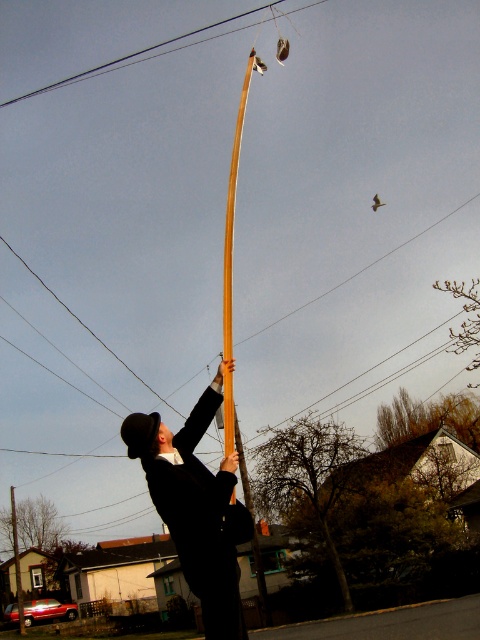
Question: Can you confirm if matte black coat at center is positioned below metallic wire at upper center?

Choices:
 (A) no
 (B) yes

Answer: (B)

Question: Does matte black coat at center have a larger size compared to wooden pole at upper center?

Choices:
 (A) no
 (B) yes

Answer: (A)

Question: Which point is farther to the camera?

Choices:
 (A) matte black coat at center
 (B) metallic wire at upper center

Answer: (B)

Question: From the image, what is the correct spatial relationship of matte black coat at center in relation to metallic wire at upper center?

Choices:
 (A) right
 (B) left

Answer: (A)

Question: Which of the following is the closest to the observer?

Choices:
 (A) (231, 241)
 (B) (149, 45)

Answer: (A)

Question: Which object is closer to the camera taking this photo?

Choices:
 (A) metallic wire at upper center
 (B) wooden pole at upper center
 (C) matte black coat at center

Answer: (C)